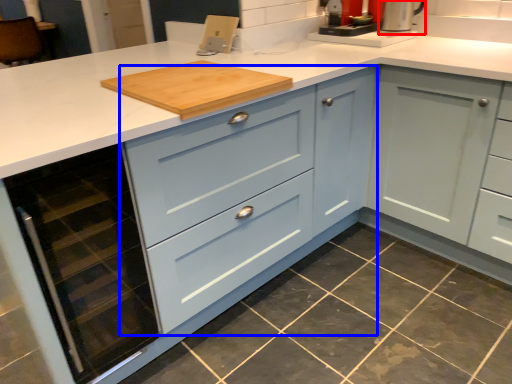
Question: Which of the following is the closest to the observer, appliance (highlighted by a red box) or cabinetry (highlighted by a blue box)?

Choices:
 (A) appliance
 (B) cabinetry

Answer: (B)